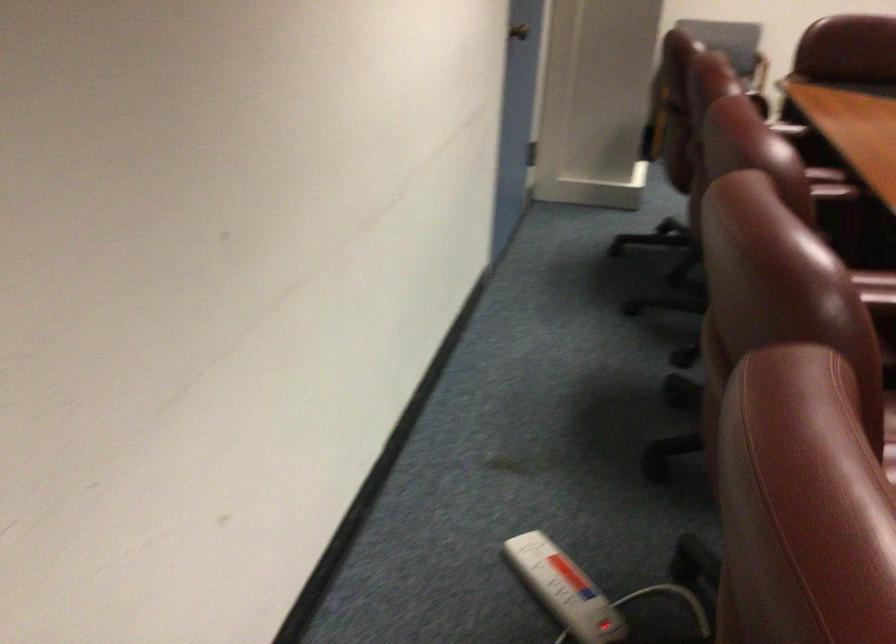
This screenshot has width=896, height=644. Describe the element at coordinates (519, 32) in the screenshot. I see `a door knob` at that location.